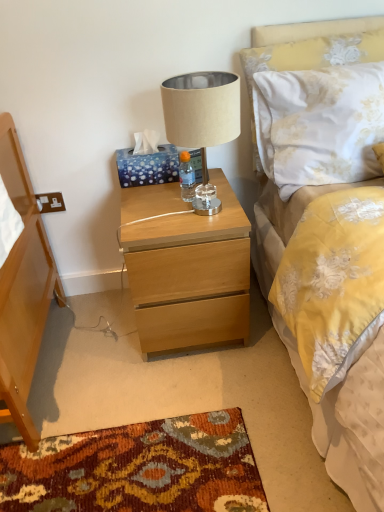
Find the location of a particular element. This screenshot has width=384, height=512. free space in front of clear plastic bottle at center is located at coordinates (185, 216).